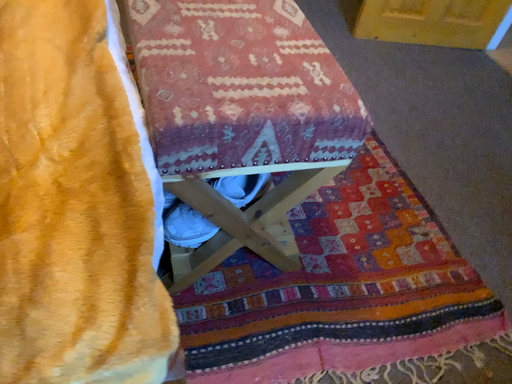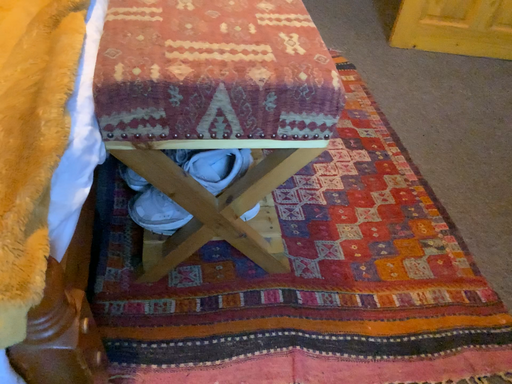
Question: How did the camera likely rotate when shooting the video?

Choices:
 (A) rotated left
 (B) rotated right

Answer: (A)